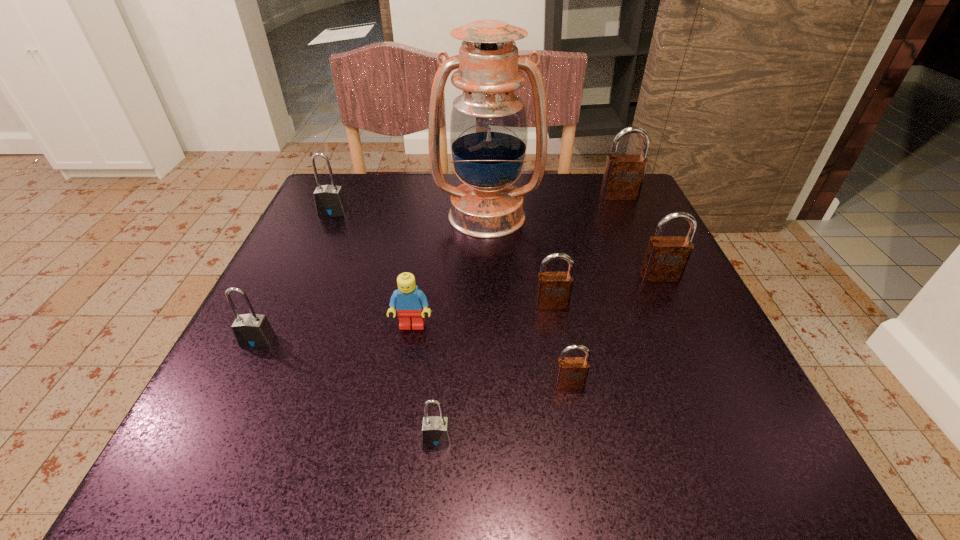
At what (x,y) coordinates should I click in order to perform the action: click on blue oil lamp. Please return your answer as a coordinate pair (x, y). This screenshot has width=960, height=540. Looking at the image, I should click on pyautogui.click(x=489, y=126).

Where is `oil lamp`? This screenshot has width=960, height=540. oil lamp is located at coordinates (489, 126).

At what (x,y) coordinates should I click in order to perform the action: click on the farthest brown padlock. Please return your answer as a coordinate pair (x, y). This screenshot has height=540, width=960. Looking at the image, I should click on (623, 177).

Where is `the eighth shortest object`? the eighth shortest object is located at coordinates (623, 177).

Where is `the sixth nearest padlock`? This screenshot has height=540, width=960. the sixth nearest padlock is located at coordinates (329, 200).

The height and width of the screenshot is (540, 960). What are the coordinates of `the farthest gray padlock` in the screenshot? It's located at (329, 200).

The width and height of the screenshot is (960, 540). I want to click on the third smallest brown padlock, so click(x=666, y=257).

I want to click on the fifth nearest padlock, so click(666, 257).

Identify the location of the second farthest gray padlock. (252, 330).

Locate an element on the screen. This screenshot has width=960, height=540. the fifth farthest padlock is located at coordinates (252, 330).